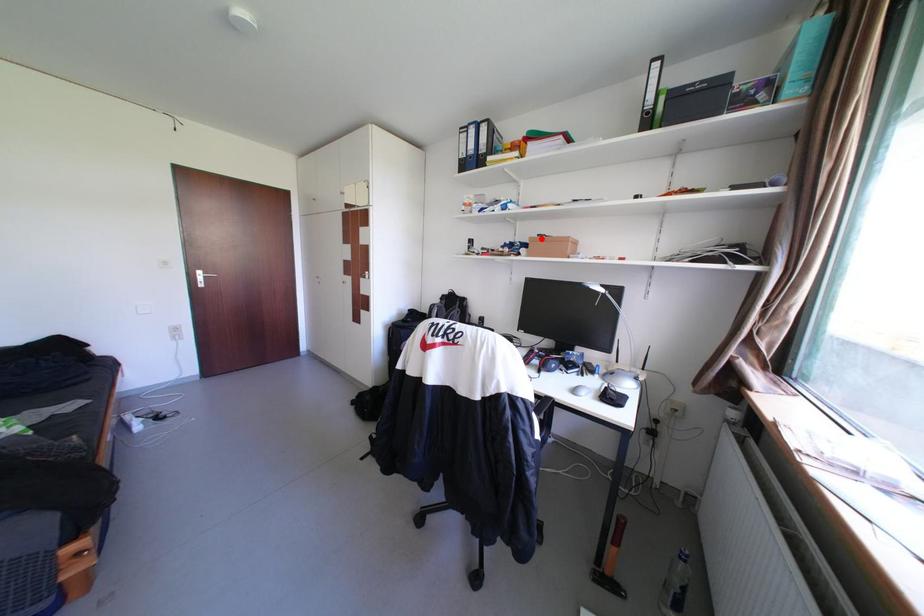
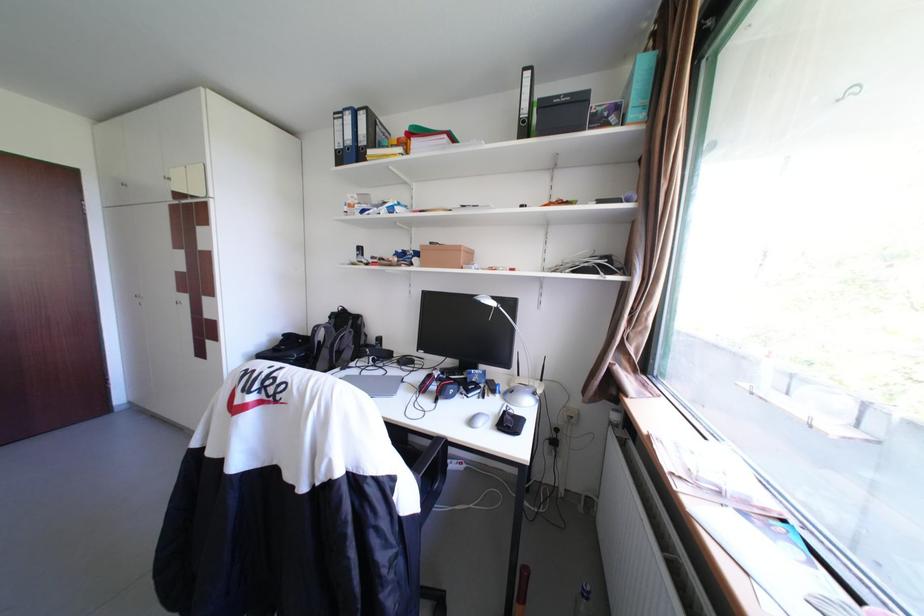
Find the pixel in the second image that matches the highlighted location in the first image.

(432, 246)